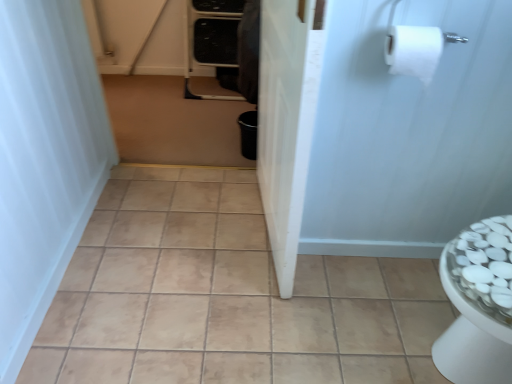
The width and height of the screenshot is (512, 384). In order to click on free space in front of white glossy screen door at center, which is counted as the second screen door, starting from the right in this screenshot , I will do `click(260, 309)`.